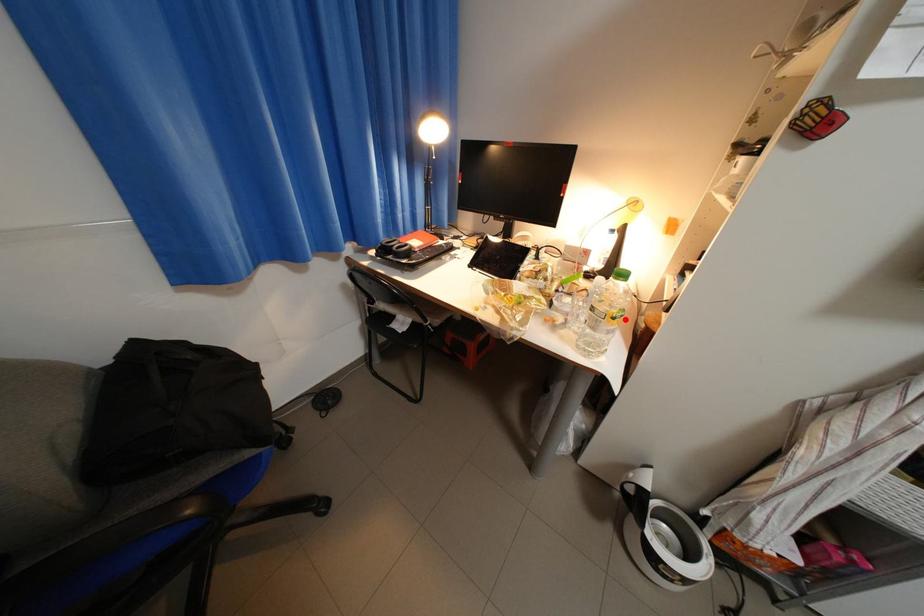
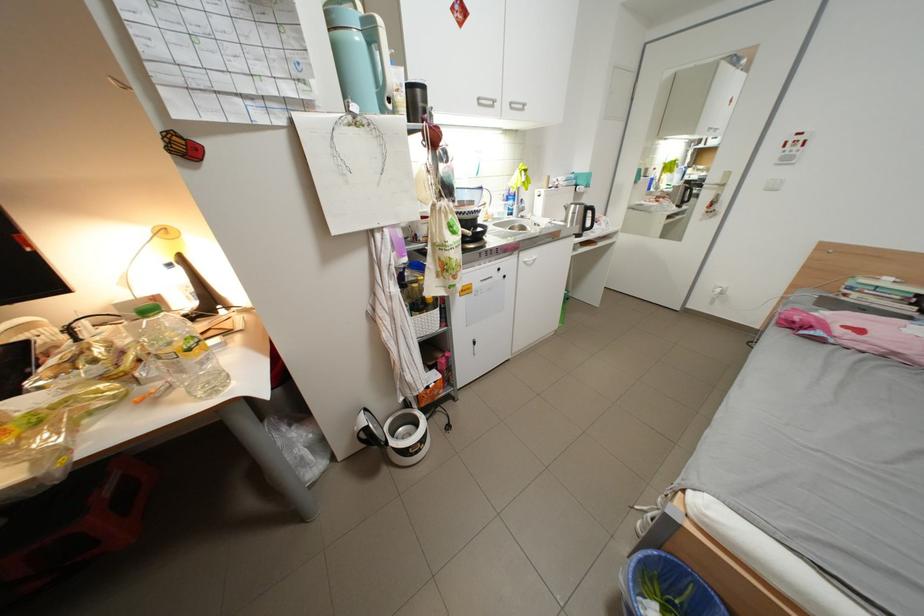
Question: I am providing you with two images of the same scene from different viewpoints. A red point is shown in image1. For the corresponding object point in image2, is it positioned nearer or farther from the camera?

Choices:
 (A) Nearer
 (B) Farther

Answer: (A)